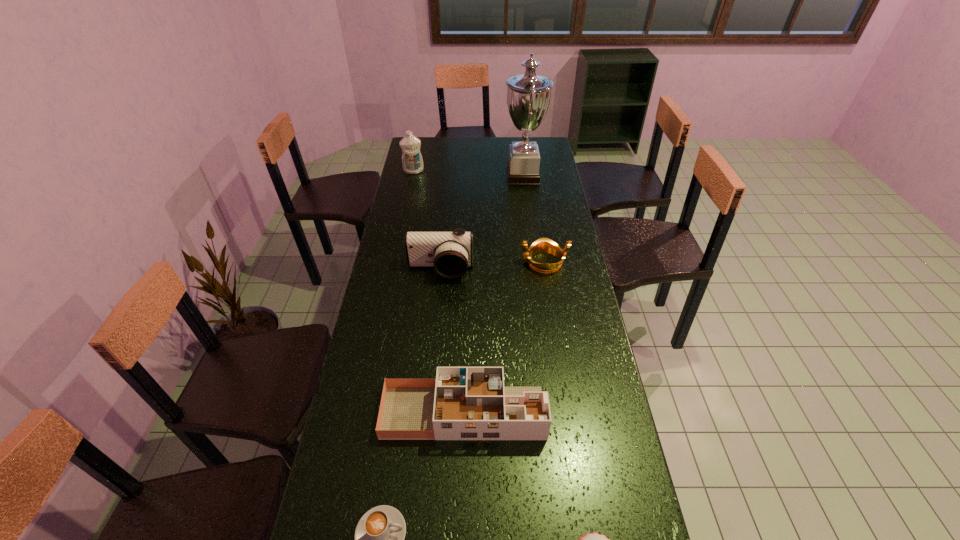
The width and height of the screenshot is (960, 540). I want to click on vacant area that satisfies the following two spatial constraints: 1. at the front view of the tallest object; 2. on the surface of the camcorder, so click(536, 271).